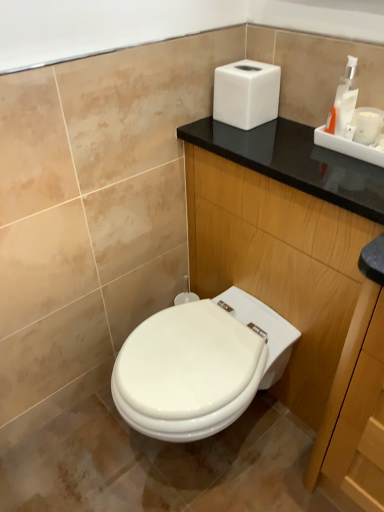
What is the approximate height of white plastic soap dispenser at upper right?

7.85 inches.

At what (x,y) coordinates should I click in order to perform the action: click on white matte hand dryer at upper right. Please return your answer as a coordinate pair (x, y). The image size is (384, 512). Looking at the image, I should click on (246, 93).

At what (x,y) coordinates should I click in order to perform the action: click on black wood dresser at upper right. Please return your answer as a coordinate pair (x, y). Looking at the image, I should click on (300, 278).

This screenshot has width=384, height=512. Describe the element at coordinates (300, 278) in the screenshot. I see `black wood dresser at upper right` at that location.

I want to click on white plastic soap dispenser at upper right, so click(343, 100).

Considering the points (289, 155) and (330, 131), which point is in front, point (289, 155) or point (330, 131)?

Point (330, 131)

Considering the sizes of black wood dresser at upper right and white plastic soap dispenser at upper right in the image, is black wood dresser at upper right bigger or smaller than white plastic soap dispenser at upper right?

Clearly, black wood dresser at upper right is larger in size than white plastic soap dispenser at upper right.

Is black wood dresser at upper right positioned far away from white plastic soap dispenser at upper right?

black wood dresser at upper right is actually quite close to white plastic soap dispenser at upper right.

Consider the image. Is black wood dresser at upper right further to the viewer compared to white plastic soap dispenser at upper right?

No, black wood dresser at upper right is closer to the viewer.

Is black wood dresser at upper right looking in the opposite direction of white matte hand dryer at upper right?

No, white matte hand dryer at upper right is not at the back of black wood dresser at upper right.

Is white matte hand dryer at upper right a part of black wood dresser at upper right?

No.

From the image's perspective, is black wood dresser at upper right beneath white matte hand dryer at upper right?

Yes.

Is black wood dresser at upper right further to camera compared to white matte hand dryer at upper right?

No, it is in front of white matte hand dryer at upper right.

From a real-world perspective, is white plastic soap dispenser at upper right positioned under white matte hand dryer at upper right based on gravity?

No.

Consider the image. Relative to white matte hand dryer at upper right, is white plastic soap dispenser at upper right in front or behind?

Visually, white plastic soap dispenser at upper right is located in front of white matte hand dryer at upper right.

Between white plastic soap dispenser at upper right and white matte hand dryer at upper right, which one has smaller width?

white plastic soap dispenser at upper right.

Who is bigger, white plastic soap dispenser at upper right or white matte hand dryer at upper right?

white matte hand dryer at upper right.

Considering the positions of objects white plastic soap dispenser at upper right and black wood dresser at upper right in the image provided, who is in front, white plastic soap dispenser at upper right or black wood dresser at upper right?

black wood dresser at upper right is in front.

Which is closer to the camera, (340, 91) or (252, 221)?

The point (340, 91) is closer to the camera.

Is white plastic soap dispenser at upper right aimed at black wood dresser at upper right?

No.

In the scene shown: Choose the correct answer: Is white plastic soap dispenser at upper right inside black wood dresser at upper right or outside it?

white plastic soap dispenser at upper right exists outside the volume of black wood dresser at upper right.

Would you say white matte hand dryer at upper right is outside black wood dresser at upper right?

Indeed, white matte hand dryer at upper right is completely outside black wood dresser at upper right.

In the scene shown: Which is further, (254,113) or (262,174)?

The point (254,113) is farther.

Between white matte hand dryer at upper right and black wood dresser at upper right, which one has larger width?

black wood dresser at upper right is wider.

Is white matte hand dryer at upper right touching black wood dresser at upper right?

No, white matte hand dryer at upper right is not with black wood dresser at upper right.

Considering the relative positions of white matte hand dryer at upper right and white plastic soap dispenser at upper right in the image provided, is white matte hand dryer at upper right to the left or to the right of white plastic soap dispenser at upper right?

From the image, it's evident that white matte hand dryer at upper right is to the left of white plastic soap dispenser at upper right.

Is white matte hand dryer at upper right wider or thinner than white plastic soap dispenser at upper right?

Clearly, white matte hand dryer at upper right has more width compared to white plastic soap dispenser at upper right.

I want to click on soap dispenser lying on the right of white matte hand dryer at upper right, so click(x=343, y=100).

The image size is (384, 512). I want to click on dresser on the left of white plastic soap dispenser at upper right, so click(300, 278).

The image size is (384, 512). What are the coordinates of `hand dryer above the black wood dresser at upper right (from the image's perspective)` in the screenshot? It's located at (246, 93).

Estimate the real-world distances between objects in this image. Which object is closer to black wood dresser at upper right, white matte hand dryer at upper right or white plastic soap dispenser at upper right?

Based on the image, white matte hand dryer at upper right appears to be nearer to black wood dresser at upper right.

Looking at the image, which one is located further to white matte hand dryer at upper right, black wood dresser at upper right or white plastic soap dispenser at upper right?

black wood dresser at upper right is positioned further to the anchor white matte hand dryer at upper right.

Looking at the image, which one is located further to white plastic soap dispenser at upper right, black wood dresser at upper right or white matte hand dryer at upper right?

black wood dresser at upper right is positioned further to the anchor white plastic soap dispenser at upper right.

Which object lies nearer to the anchor point black wood dresser at upper right, white plastic soap dispenser at upper right or white matte hand dryer at upper right?

white matte hand dryer at upper right is positioned closer to the anchor black wood dresser at upper right.

In the scene shown: Based on their spatial positions, is white matte hand dryer at upper right or black wood dresser at upper right further from white plastic soap dispenser at upper right?

The object further to white plastic soap dispenser at upper right is black wood dresser at upper right.

Based on their spatial positions, is white plastic soap dispenser at upper right or black wood dresser at upper right closer to white matte hand dryer at upper right?

white plastic soap dispenser at upper right is closer to white matte hand dryer at upper right.

Where is `soap dispenser between white matte hand dryer at upper right and black wood dresser at upper right vertically`? soap dispenser between white matte hand dryer at upper right and black wood dresser at upper right vertically is located at coordinates (343, 100).